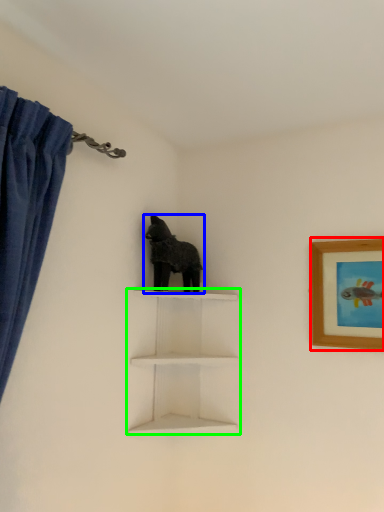
Question: Which object is positioned closest to picture frame (highlighted by a red box)? Select from animal (highlighted by a blue box) and shelf (highlighted by a green box).

Choices:
 (A) animal
 (B) shelf

Answer: (B)